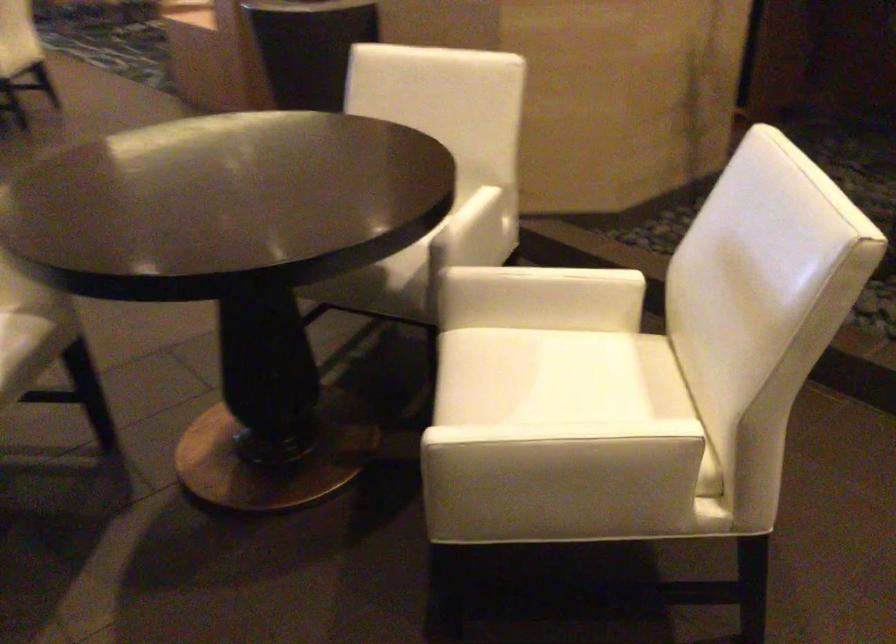
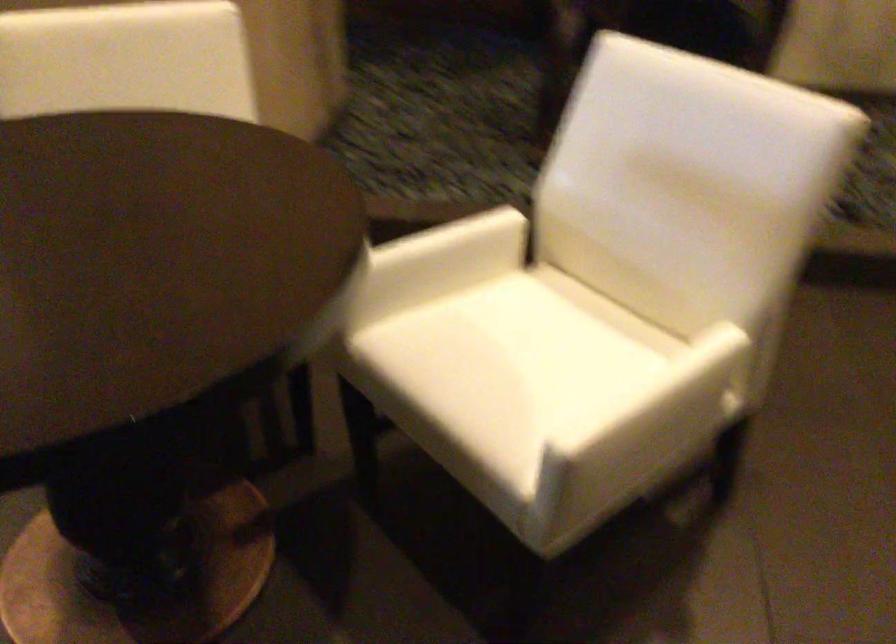
Locate, in the second image, the point that corresponds to (586,462) in the first image.

(684, 402)